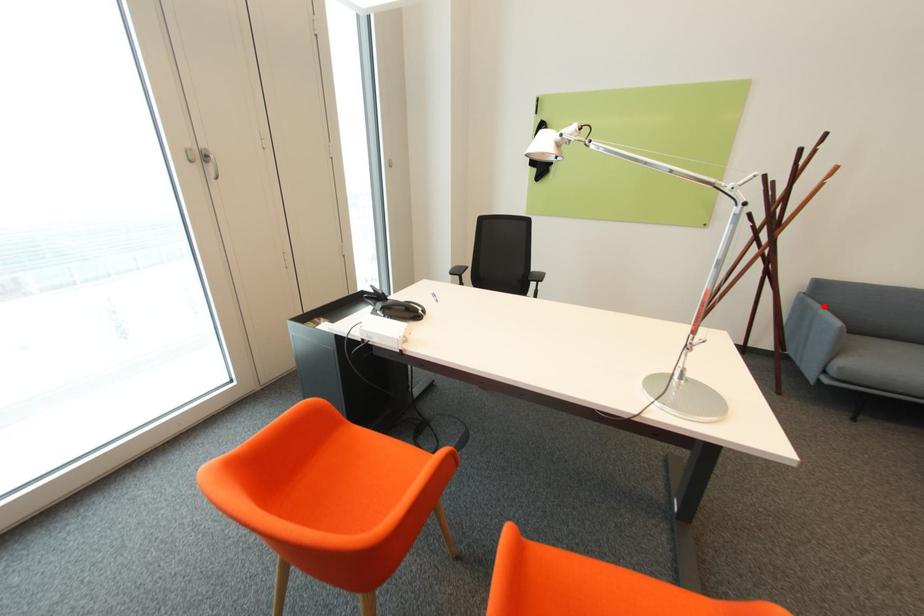
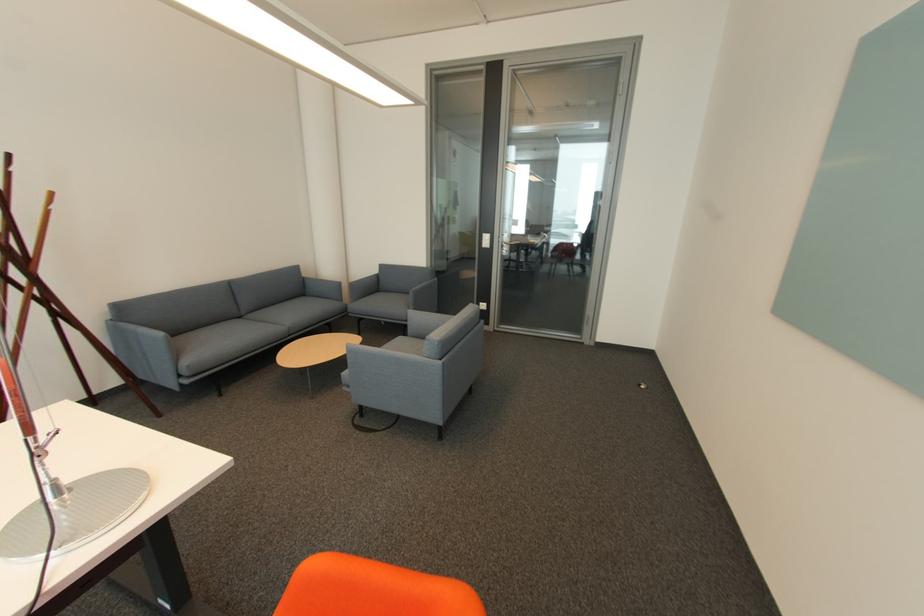
The point at the highlighted location is marked in the first image. Where is the corresponding point in the second image?

(139, 328)